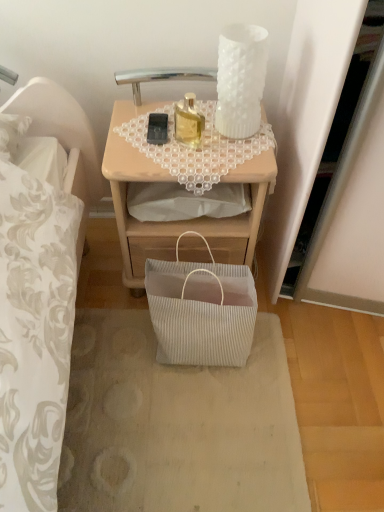
Question: Does translucent glass bottle at center have a smaller size compared to white pleated bag at lower center?

Choices:
 (A) no
 (B) yes

Answer: (B)

Question: Is translucent glass bottle at center beside white pleated bag at lower center?

Choices:
 (A) no
 (B) yes

Answer: (A)

Question: Is translucent glass bottle at center aimed at white pleated bag at lower center?

Choices:
 (A) no
 (B) yes

Answer: (A)

Question: Can you confirm if translucent glass bottle at center is wider than white pleated bag at lower center?

Choices:
 (A) yes
 (B) no

Answer: (B)

Question: Is translucent glass bottle at center not close to white pleated bag at lower center?

Choices:
 (A) yes
 (B) no

Answer: (B)

Question: From the image's perspective, is translucent glass bottle at center under white pleated bag at lower center?

Choices:
 (A) no
 (B) yes

Answer: (A)

Question: Is white pleated paper bag at lower center thinner than black matte mobile phone at upper center?

Choices:
 (A) yes
 (B) no

Answer: (B)

Question: Is black matte mobile phone at upper center surrounded by white pleated paper bag at lower center?

Choices:
 (A) no
 (B) yes

Answer: (A)

Question: Is white pleated paper bag at lower center facing away from black matte mobile phone at upper center?

Choices:
 (A) no
 (B) yes

Answer: (A)

Question: Could you tell me if white pleated paper bag at lower center is facing black matte mobile phone at upper center?

Choices:
 (A) no
 (B) yes

Answer: (A)

Question: Is white pleated paper bag at lower center positioned in front of black matte mobile phone at upper center?

Choices:
 (A) yes
 (B) no

Answer: (A)

Question: From the image's perspective, is white pleated paper bag at lower center over black matte mobile phone at upper center?

Choices:
 (A) no
 (B) yes

Answer: (A)

Question: Can you confirm if white pleated paper bag at lower center is shorter than wooden desk at center?

Choices:
 (A) yes
 (B) no

Answer: (A)